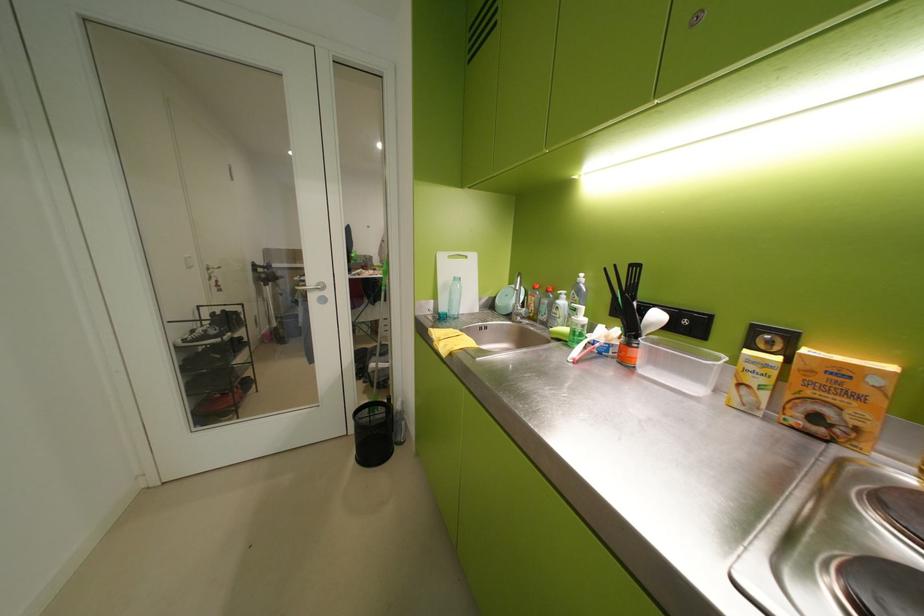
The height and width of the screenshot is (616, 924). In order to click on black control dial in this screenshot , I will do `click(772, 339)`.